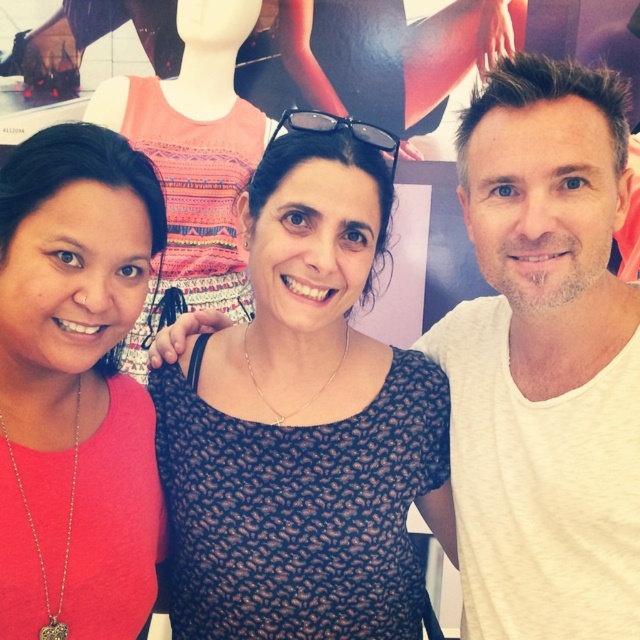
You are a photographer trying to adjust the lighting for a group photo. You notice the pink matte shirt at left and the black dotted dress at center. Which object is closer to the camera?

The black dotted dress at center is closer to the camera because the pink matte shirt at left is behind it.